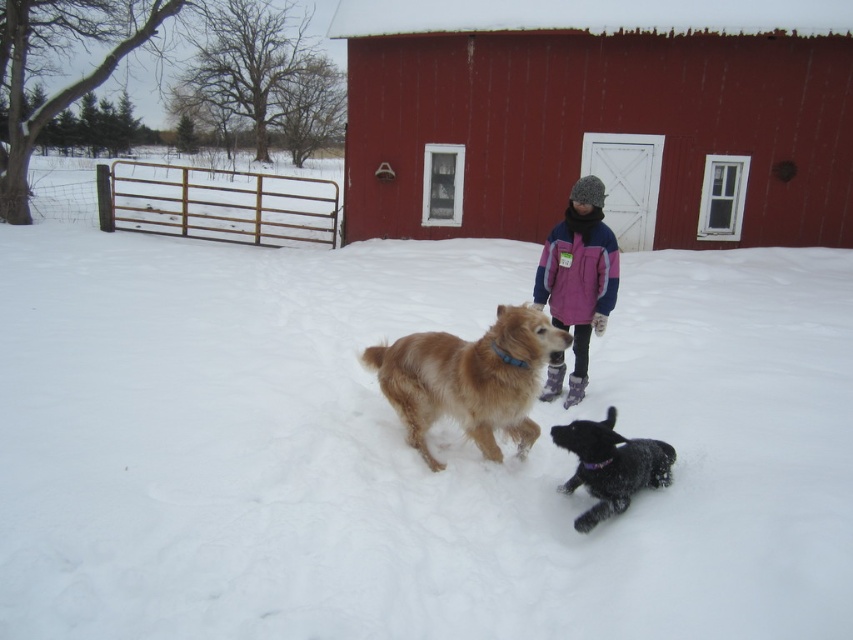
You are a photographer setting up a tripod in the snowy scene. You want to capture both the smooth wooden barn at center and the purple fleece jacket at center in the same frame. Since the barn is much taller than the jacket, how should you adjust your camera angle to include both subjects effectively?

Since the smooth wooden barn at center is much taller than the purple fleece jacket at center, you should lower your camera angle to ensure the barn fits within the frame while still capturing the jacket at the base.

You are a photographer trying to capture both the golden fur dog at center and the shiny black dog at lower right in a single frame. Given that your camera can only accommodate the width of the wider dog, which dog should you focus on to ensure both fit in the photo?

The golden fur dog at center has a greater width than the shiny black dog at lower right. To ensure both fit in the frame, focus on the golden fur dog at center since its width is wider, allowing the smaller dog to fit within the camera range.